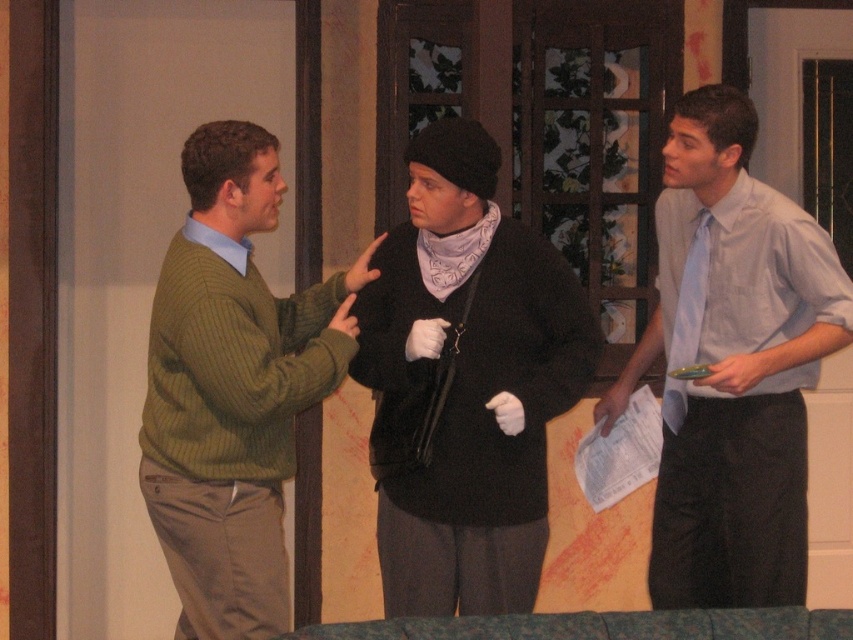
You are an actor in a play and need to adjust your costume. You see the black sweater at center and the light blue shirt at right. Which one is positioned lower on the stage?

The black sweater at center is positioned lower on the stage than the light blue shirt at right.